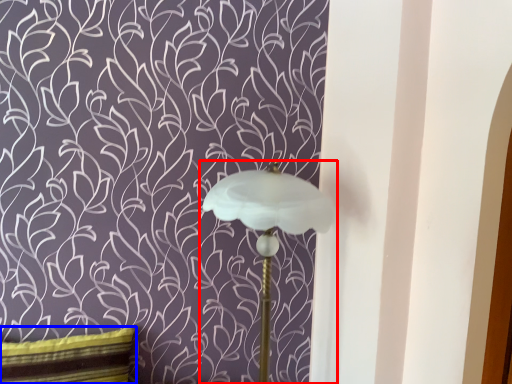
Question: Which object appears farthest to the camera in this image, lamp (highlighted by a red box) or pillow (highlighted by a blue box)?

Choices:
 (A) lamp
 (B) pillow

Answer: (B)